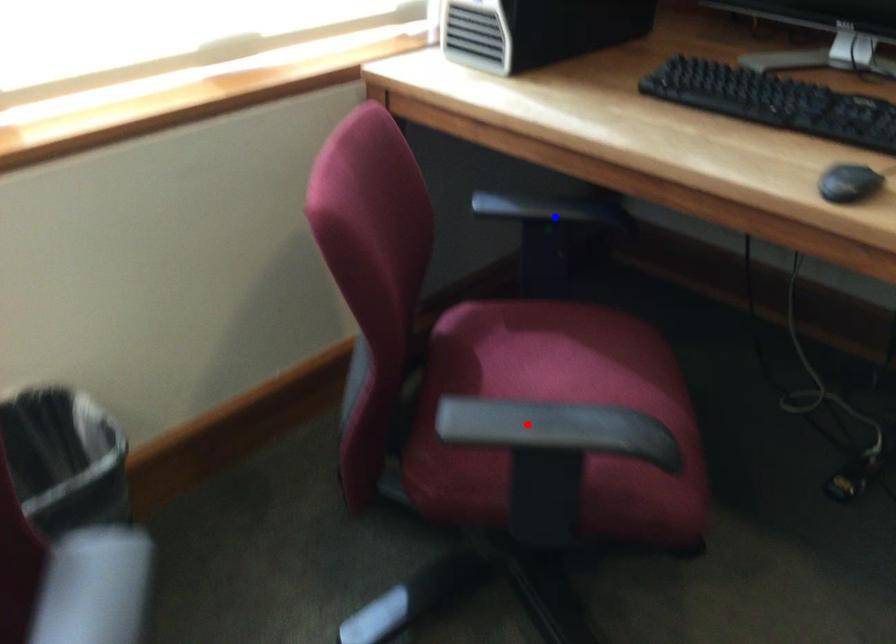
Question: Which of the two points in the image is closer to the camera?

Choices:
 (A) Blue point is closer.
 (B) Red point is closer.

Answer: (B)